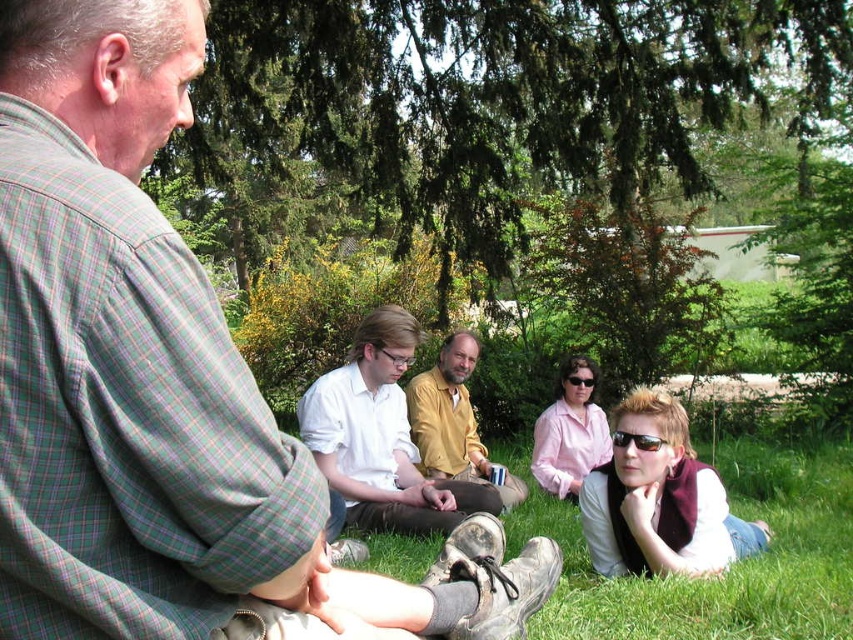
Question: Considering the relative positions of matte yellow shirt at center and matte black sunglasses at center in the image provided, where is matte yellow shirt at center located with respect to matte black sunglasses at center?

Choices:
 (A) right
 (B) left

Answer: (B)

Question: Among these objects, which one is farthest from the camera?

Choices:
 (A) green leafy tree at upper center
 (B) matte black sunglasses at center
 (C) white shirt at center

Answer: (A)

Question: Does green grass at lower center have a larger size compared to white shirt at center?

Choices:
 (A) no
 (B) yes

Answer: (A)

Question: Does green leafy tree at upper center have a smaller size compared to white shirt at center?

Choices:
 (A) yes
 (B) no

Answer: (A)

Question: Which of the following is the farthest from the observer?

Choices:
 (A) matte black sunglasses at center
 (B) green grass at lower center
 (C) black plastic sunglasses at lower center
 (D) clear plastic glasses at center

Answer: (A)

Question: Which object is farther from the camera taking this photo?

Choices:
 (A) black plastic sunglasses at lower center
 (B) plaid fabric shirt at upper left
 (C) matte black sunglasses at center
 (D) clear plastic glasses at center

Answer: (C)